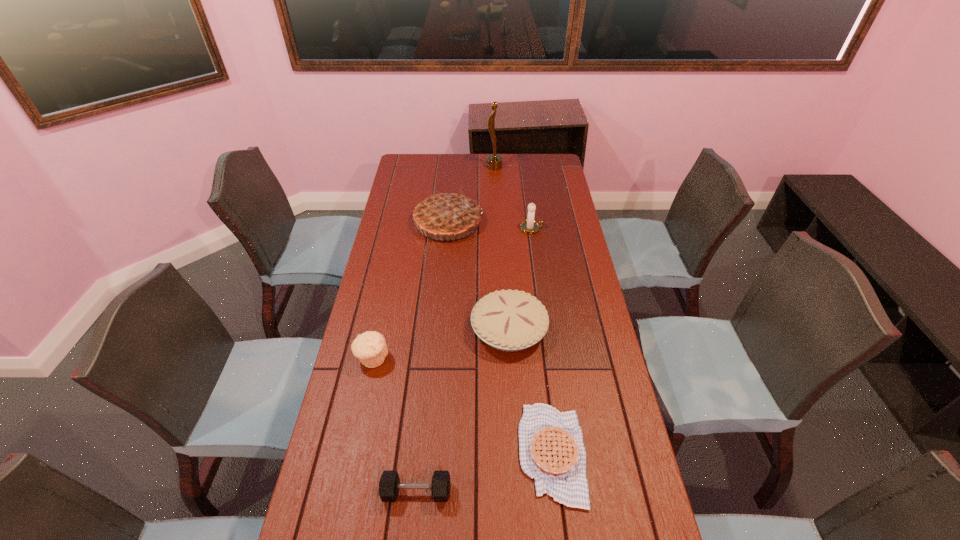
The image size is (960, 540). I want to click on free region that satisfies the following two spatial constraints: 1. on the front-facing side of the award; 2. on the back side of the nearest pie, so click(x=508, y=454).

I want to click on free space that satisfies the following two spatial constraints: 1. on the handle side of the candle holder; 2. on the front side of the sixth tallest object, so click(567, 492).

Locate an element on the screen. The width and height of the screenshot is (960, 540). blank area in the image that satisfies the following two spatial constraints: 1. on the handle side of the candle holder; 2. on the front side of the muffin is located at coordinates (549, 358).

The image size is (960, 540). Identify the location of free space that satisfies the following two spatial constraints: 1. on the back side of the shortest pie; 2. on the right side of the dumbbell. (420, 454).